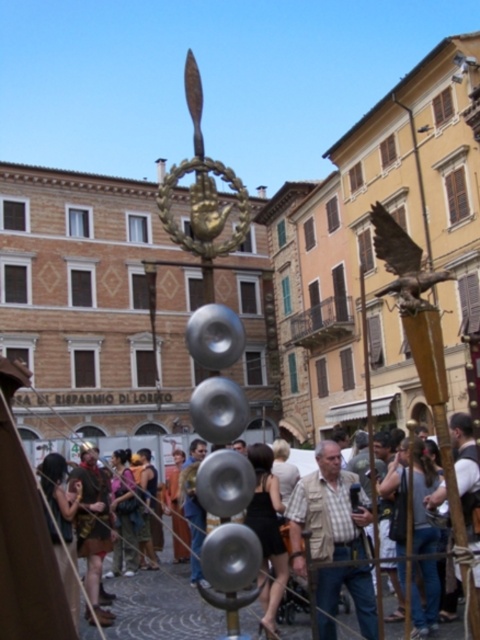
You are a tailor measuring items for alterations. You need to determine which item, the light brown leather jacket at center or the bronze eagle at upper right, requires a wider workspace. Based on their sizes, which one should you prioritize for a larger workspace?

The bronze eagle at upper right requires a larger workspace because its width is greater than the light brown leather jacket at center.